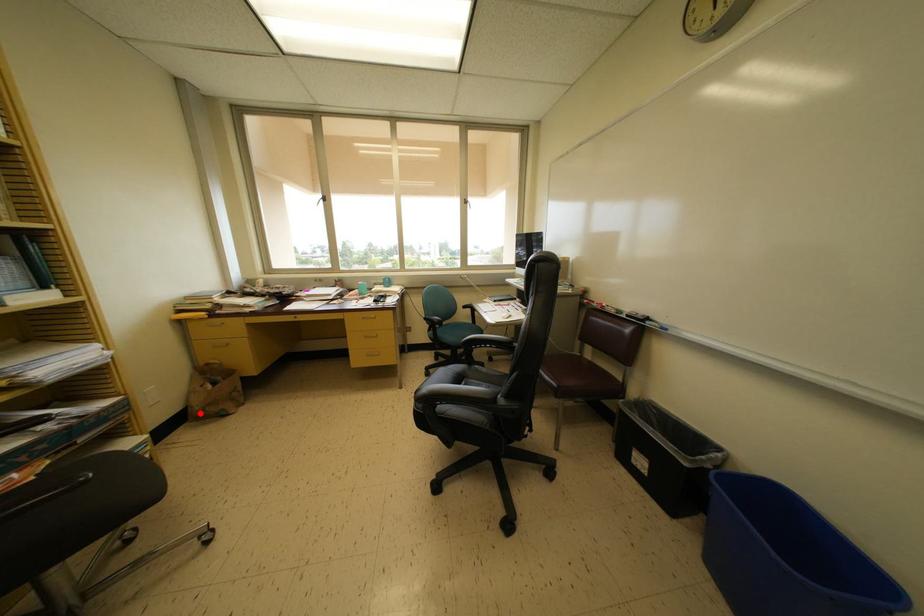
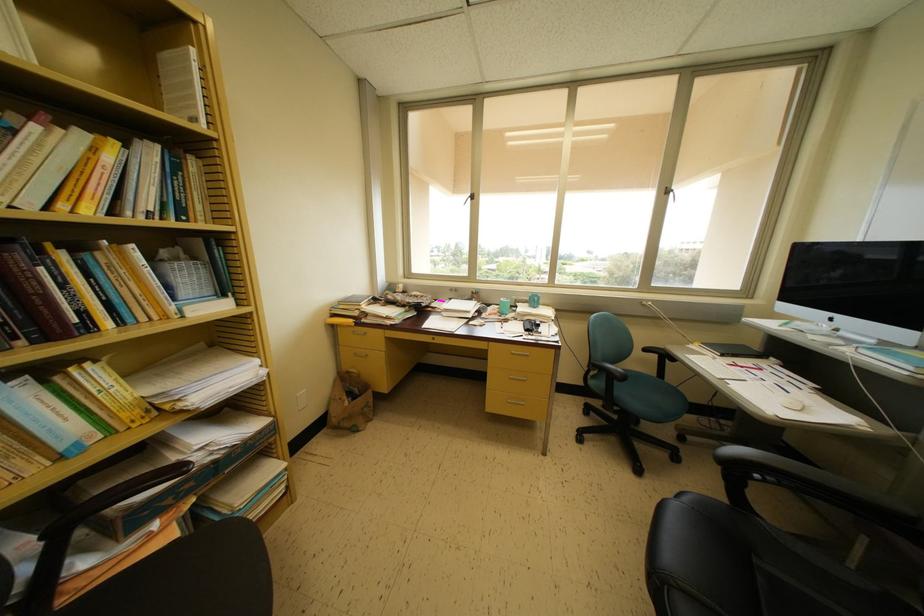
Find the pixel in the second image that matches the highlighted location in the first image.

(337, 424)